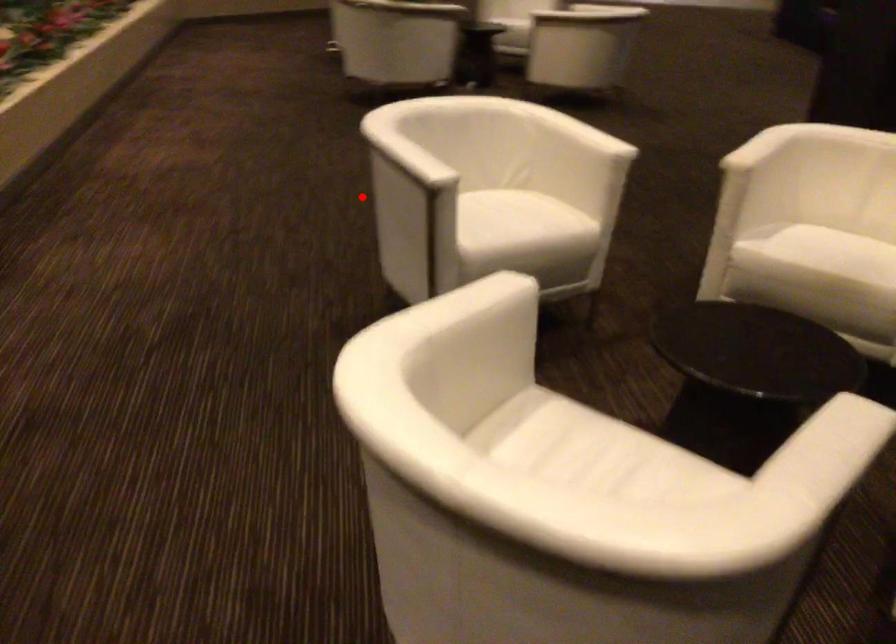
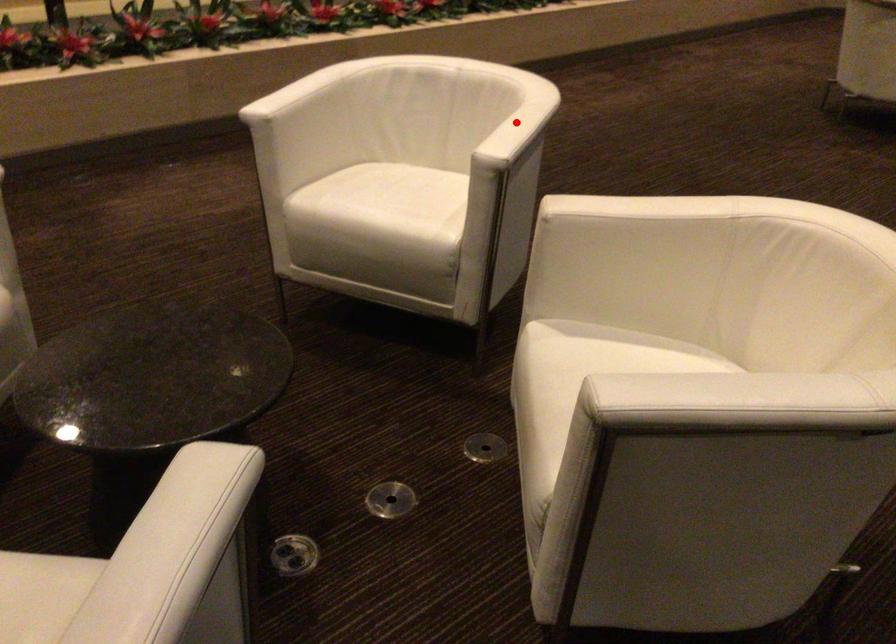
I am providing you with two images of the same scene from different viewpoints. A red point is marked on the first image and another point is marked on the second image. Are the points marked in image1 and image2 representing the same 3D position?

No